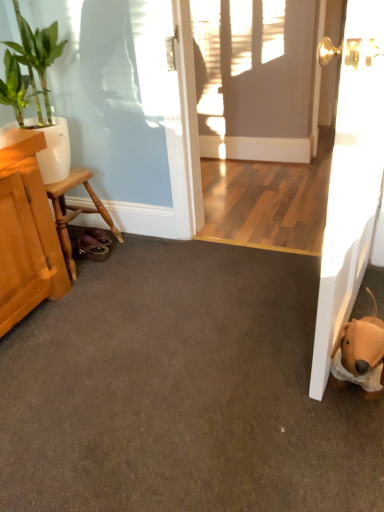
Image resolution: width=384 pixels, height=512 pixels. I want to click on free space that is to the left of brown plush dog at lower right, so click(x=285, y=391).